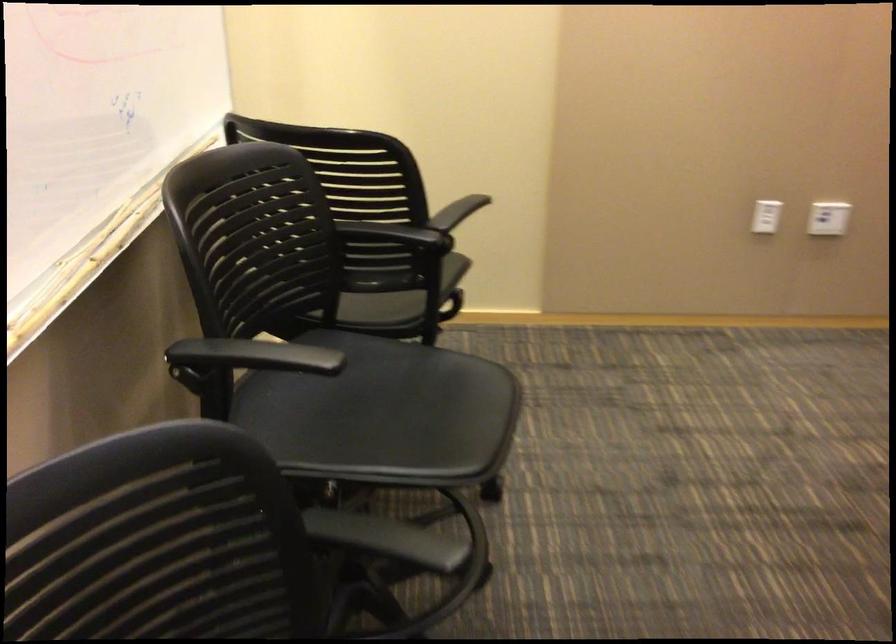
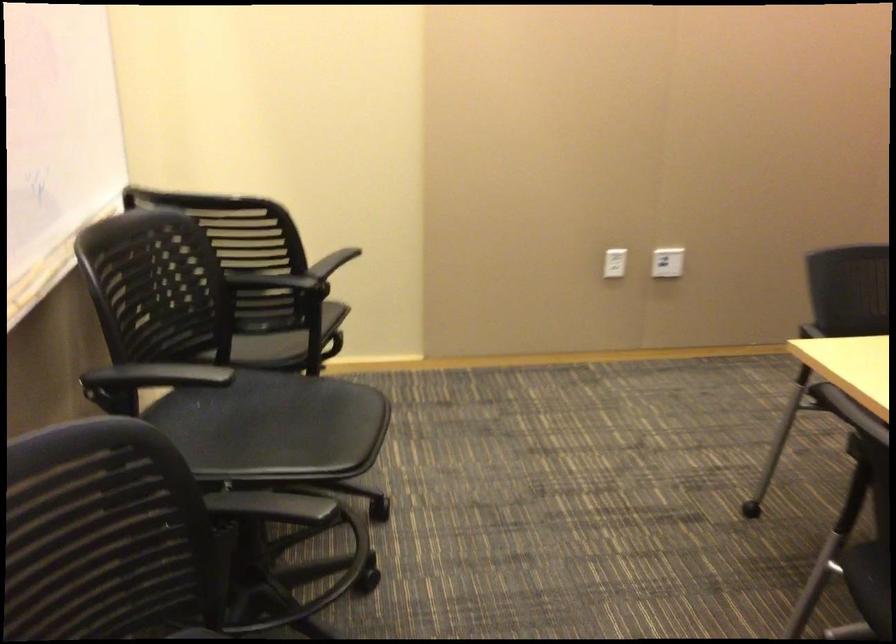
The point at (824, 220) is marked in the first image. Where is the corresponding point in the second image?

(667, 261)